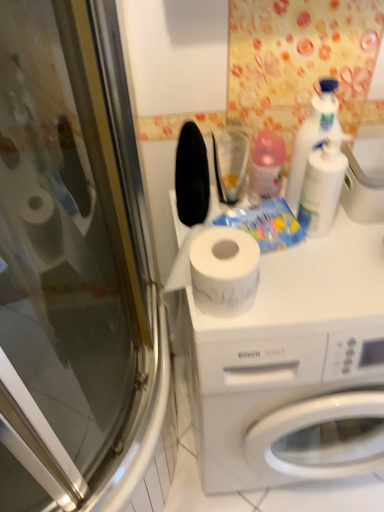
Where is `unoccupied area in front of white plastic bottle at upper right, which is the 3th cleaning product in left-to-right order`? Image resolution: width=384 pixels, height=512 pixels. unoccupied area in front of white plastic bottle at upper right, which is the 3th cleaning product in left-to-right order is located at coordinates (327, 269).